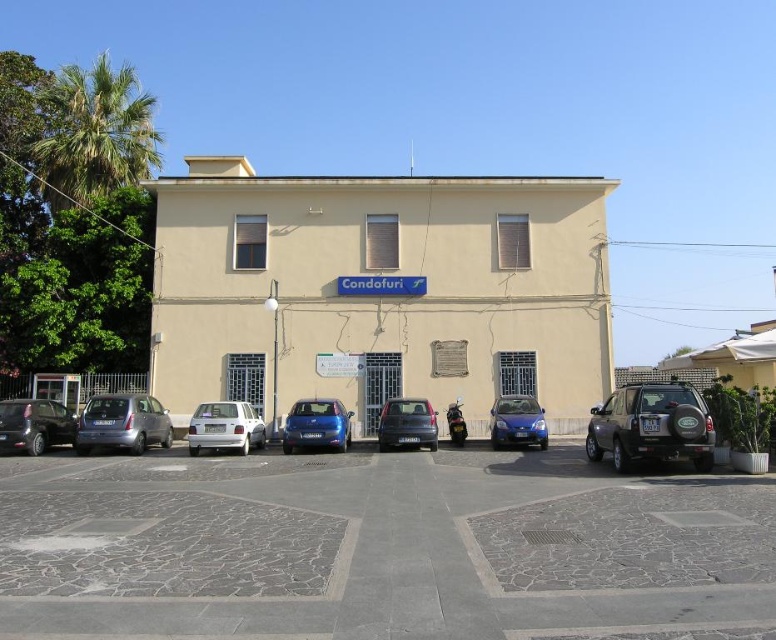
Does glossy blue hatchback at center have a greater width compared to blue metallic hatchback at center?

Yes, glossy blue hatchback at center is wider than blue metallic hatchback at center.

Can you confirm if glossy blue hatchback at center is positioned above blue metallic hatchback at center?

No.

Between point (321, 424) and point (492, 426), which one is positioned behind?

Positioned behind is point (492, 426).

Identify the location of glossy blue hatchback at center. (317, 426).

Which is behind, point (49, 444) or point (532, 436)?

The point (49, 444) is behind.

Is shiny black car at lower left taller than blue metallic hatchback at center?

Yes.

Measure the distance between point (5, 429) and camera.

Point (5, 429) and camera are 17.80 meters apart from each other.

You are a GUI agent. You are given a task and a screenshot of the screen. Output one action in this format:
    pyautogui.click(x=<x>, y=<y>)
    Task: Click on the shiny black car at lower left
    The height and width of the screenshot is (640, 776).
    Given the screenshot: What is the action you would take?
    pyautogui.click(x=33, y=426)

How distant is dark gray metallic suv at right from shiny black car at lower left?

dark gray metallic suv at right and shiny black car at lower left are 54.28 feet apart.

Does dark gray metallic suv at right have a smaller size compared to shiny black car at lower left?

Yes, dark gray metallic suv at right is smaller than shiny black car at lower left.

Is point (591, 422) positioned in front of point (26, 451)?

Yes, point (591, 422) is closer to viewer.

Image resolution: width=776 pixels, height=640 pixels. I want to click on dark gray metallic suv at right, so click(650, 426).